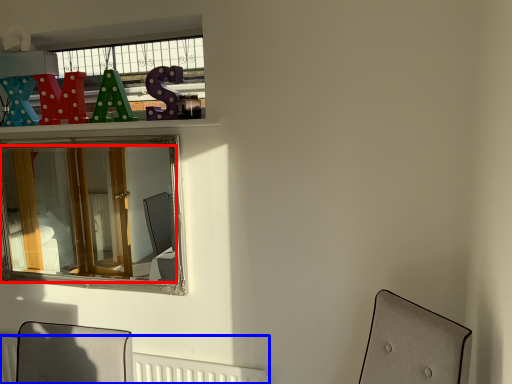
Question: Which of the following is the farthest to the observer, mirror (highlighted by a red box) or radiator (highlighted by a blue box)?

Choices:
 (A) mirror
 (B) radiator

Answer: (B)